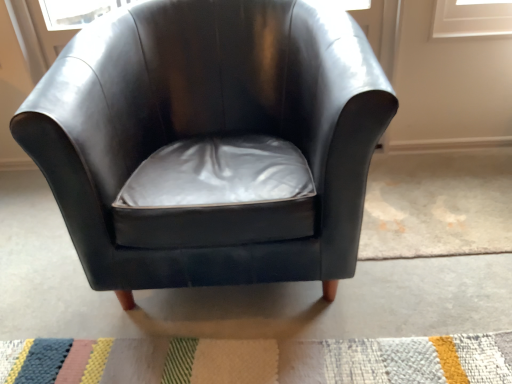
Question: In terms of size, does glossy leather chair at center appear bigger or smaller than multicolored woven mat at lower center?

Choices:
 (A) small
 (B) big

Answer: (B)

Question: Relative to multicolored woven mat at lower center, is glossy leather chair at center in front or behind?

Choices:
 (A) behind
 (B) front

Answer: (B)

Question: From the image's perspective, is glossy leather chair at center positioned above or below multicolored woven mat at lower center?

Choices:
 (A) below
 (B) above

Answer: (B)

Question: From the image's perspective, relative to glossy leather chair at center, is multicolored woven mat at lower center above or below?

Choices:
 (A) below
 (B) above

Answer: (A)

Question: Considering the positions of multicolored woven mat at lower center and glossy leather chair at center in the image, is multicolored woven mat at lower center taller or shorter than glossy leather chair at center?

Choices:
 (A) tall
 (B) short

Answer: (B)

Question: Choose the correct answer: Is multicolored woven mat at lower center inside glossy leather chair at center or outside it?

Choices:
 (A) outside
 (B) inside

Answer: (A)

Question: From a real-world perspective, is multicolored woven mat at lower center above or below glossy leather chair at center?

Choices:
 (A) below
 (B) above

Answer: (A)